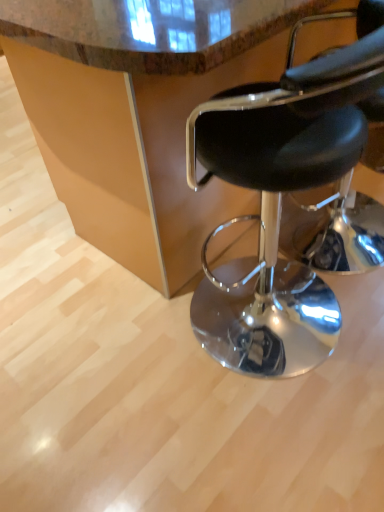
This screenshot has width=384, height=512. Find the location of `black leather stool at right`. black leather stool at right is located at coordinates (281, 196).

The image size is (384, 512). Describe the element at coordinates (281, 196) in the screenshot. I see `black leather stool at right` at that location.

Measure the distance between point (148, 278) and camera.

The depth of point (148, 278) is 1.53 meters.

What do you see at coordinates (139, 112) in the screenshot? The image size is (384, 512). I see `marble countertop at center` at bounding box center [139, 112].

I want to click on marble countertop at center, so click(x=139, y=112).

Identify the location of black leather stool at right. The image size is (384, 512). (281, 196).

Based on the photo, would you say black leather stool at right is to the left or to the right of marble countertop at center in the picture?

From the image, it's evident that black leather stool at right is to the left of marble countertop at center.

Who is more distant, black leather stool at right or marble countertop at center?

marble countertop at center is more distant.

Which is farther, (339, 149) or (109, 243)?

Positioned behind is point (109, 243).

From the image's perspective, is black leather stool at right located beneath marble countertop at center?

Yes, from the image's perspective, black leather stool at right is below marble countertop at center.

Consider the image. From a real-world perspective, is black leather stool at right positioned above or below marble countertop at center?

black leather stool at right is above marble countertop at center.

Considering the sizes of objects black leather stool at right and marble countertop at center in the image provided, who is thinner, black leather stool at right or marble countertop at center?

black leather stool at right.

Does black leather stool at right have a greater height compared to marble countertop at center?

No, black leather stool at right is not taller than marble countertop at center.

Considering the relative sizes of black leather stool at right and marble countertop at center in the image provided, is black leather stool at right bigger than marble countertop at center?

Incorrect, black leather stool at right is not larger than marble countertop at center.

Is black leather stool at right not inside marble countertop at center?

Actually, black leather stool at right is at least partially inside marble countertop at center.

Would you consider black leather stool at right to be distant from marble countertop at center?

black leather stool at right is actually quite close to marble countertop at center.

Is black leather stool at right turned away from marble countertop at center?

Yes, black leather stool at right's orientation is away from marble countertop at center.

Can you tell me how much black leather stool at right and marble countertop at center differ in facing direction?

The angular difference between black leather stool at right and marble countertop at center is 1.57 degrees.

Find the location of a particular element. table that appears above the black leather stool at right (from the image's perspective) is located at coordinates (139, 112).

Considering the positions of objects marble countertop at center and black leather stool at right in the image provided, who is more to the left, marble countertop at center or black leather stool at right?

Result: Positioned to the left is black leather stool at right.

Is the position of marble countertop at center more distant than that of black leather stool at right?

Yes.

Which is nearer, (185, 9) or (313, 331)?

Point (185, 9).

From the image's perspective, would you say marble countertop at center is shown under black leather stool at right?

No.

From a real-world perspective, is marble countertop at center located beneath black leather stool at right?

Indeed, from a real-world perspective, marble countertop at center is positioned beneath black leather stool at right.

In the scene shown: Is marble countertop at center wider or thinner than black leather stool at right?

marble countertop at center is wider than black leather stool at right.

Is marble countertop at center taller than black leather stool at right?

Yes.

Considering the sizes of objects marble countertop at center and black leather stool at right in the image provided, who is bigger, marble countertop at center or black leather stool at right?

marble countertop at center.

Choose the correct answer: Is marble countertop at center inside black leather stool at right or outside it?

marble countertop at center is not inside black leather stool at right, it's outside.

Is marble countertop at center touching black leather stool at right?

There is a gap between marble countertop at center and black leather stool at right.

Is marble countertop at center oriented away from black leather stool at right?

Correct, marble countertop at center is looking away from black leather stool at right.

Consider the image. How different are the orientations of marble countertop at center and black leather stool at right in degrees?

The facing directions of marble countertop at center and black leather stool at right are 1.57 degrees apart.

How far apart are marble countertop at center and black leather stool at right?

marble countertop at center and black leather stool at right are 17.85 inches apart.

Find the location of a particular element. This screenshot has height=512, width=384. chair that appears on the left of marble countertop at center is located at coordinates [281, 196].

Where is `table that is behind the black leather stool at right`? The image size is (384, 512). table that is behind the black leather stool at right is located at coordinates (139, 112).

This screenshot has width=384, height=512. Find the location of `table below the black leather stool at right (from a real-world perspective)`. table below the black leather stool at right (from a real-world perspective) is located at coordinates (139, 112).